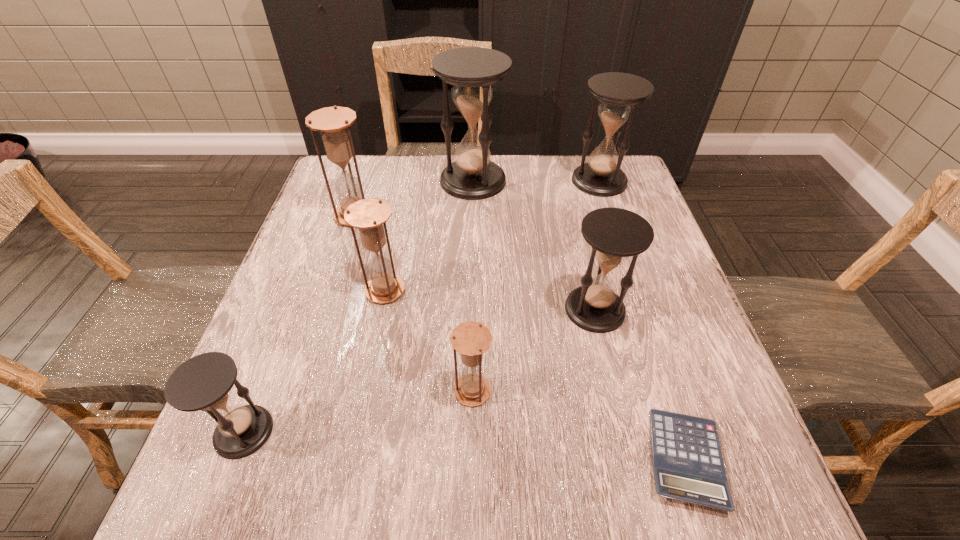
Image resolution: width=960 pixels, height=540 pixels. Find the location of `the nearest black hourglass`. the nearest black hourglass is located at coordinates (203, 382).

Identify the location of the smallest black hourglass. The width and height of the screenshot is (960, 540). (203, 382).

Where is `calculator`? calculator is located at coordinates (688, 466).

The width and height of the screenshot is (960, 540). Identify the location of vacant region located on the right of the tallest object. (631, 181).

At what (x,y) coordinates should I click in order to perform the action: click on free space located on the front of the second biggest black hourglass. Please return your answer as a coordinate pair (x, y). Image resolution: width=960 pixels, height=540 pixels. Looking at the image, I should click on (613, 223).

The width and height of the screenshot is (960, 540). I want to click on free space located 0.160m on the front of the sixth nearest object, so click(x=336, y=274).

You are a GUI agent. You are given a task and a screenshot of the screen. Output one action in this format:
    pyautogui.click(x=<x>, y=<y>)
    Task: Click on the vacant space situated on the left of the third biggest black hourglass
    Image resolution: width=960 pixels, height=540 pixels.
    Given the screenshot: What is the action you would take?
    pyautogui.click(x=537, y=309)

Find the location of `vacant space located on the left of the fifth hourglass from right to left`. vacant space located on the left of the fifth hourglass from right to left is located at coordinates (314, 291).

Image resolution: width=960 pixels, height=540 pixels. I want to click on free region located on the back of the nearest brown hourglass, so click(x=474, y=233).

Find the location of a particular element. This screenshot has width=960, height=540. blank area located 0.070m on the front of the smallest black hourglass is located at coordinates (214, 508).